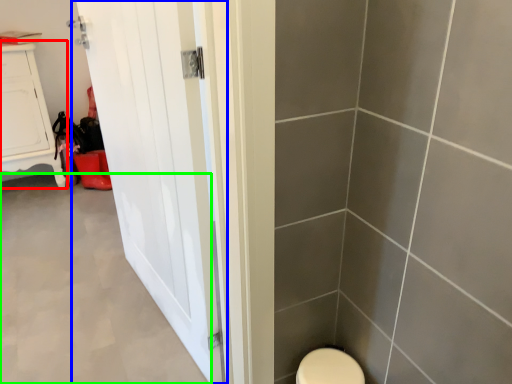
Question: Based on their relative distances, which object is nearer to furniture (highlighted by a red box)? Choose from door (highlighted by a blue box) and plain (highlighted by a green box).

Choices:
 (A) door
 (B) plain

Answer: (B)